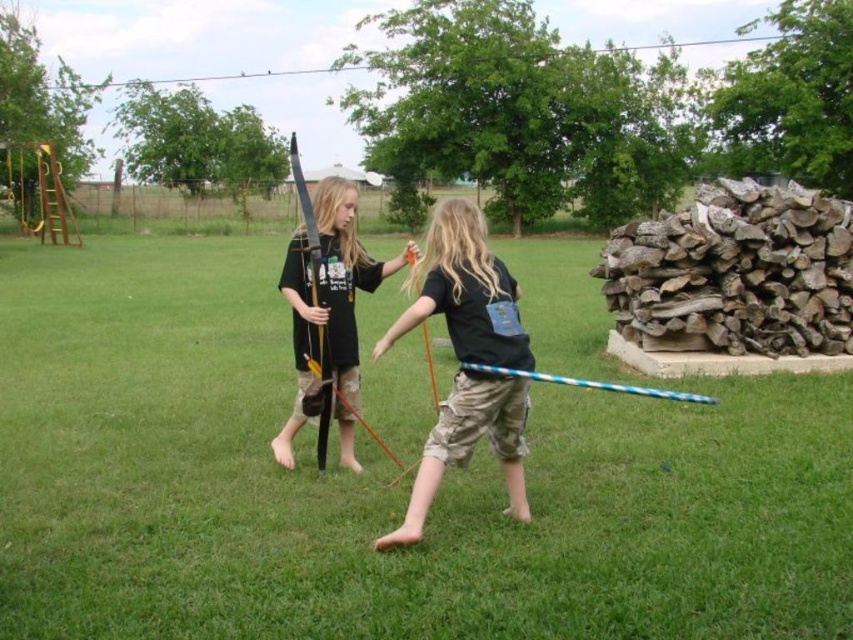
Based on the photo, does green grass at center have a greater width compared to matte black bow at center?

Yes, green grass at center is wider than matte black bow at center.

Identify the location of green grass at center. (386, 474).

Identify the location of green grass at center. (386, 474).

Is green grass at center closer to camera compared to black matte hula hoop at center?

That is True.

Who is higher up, green grass at center or black matte hula hoop at center?

green grass at center

Between point (155, 387) and point (466, 378), which one is positioned behind?

Positioned behind is point (155, 387).

This screenshot has height=640, width=853. In order to click on green grass at center in this screenshot , I will do `click(386, 474)`.

Can you confirm if black matte hula hoop at center is smaller than matte black bow at center?

Actually, black matte hula hoop at center might be larger than matte black bow at center.

Which is above, black matte hula hoop at center or matte black bow at center?

matte black bow at center is above.

Between point (456, 321) and point (289, 435), which one is positioned behind?

The point (289, 435) is more distant.

Locate an element on the screen. black matte hula hoop at center is located at coordinates (463, 291).